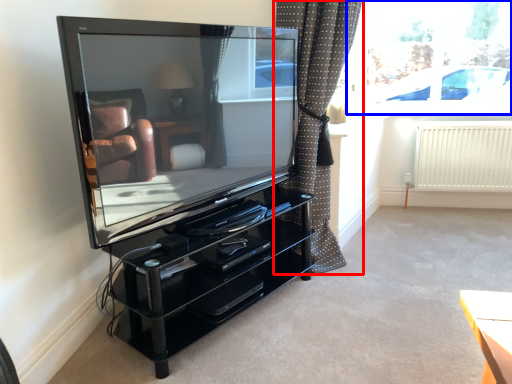
Question: Which point is further to the camera, curtain (highlighted by a red box) or window screen (highlighted by a blue box)?

Choices:
 (A) curtain
 (B) window screen

Answer: (B)